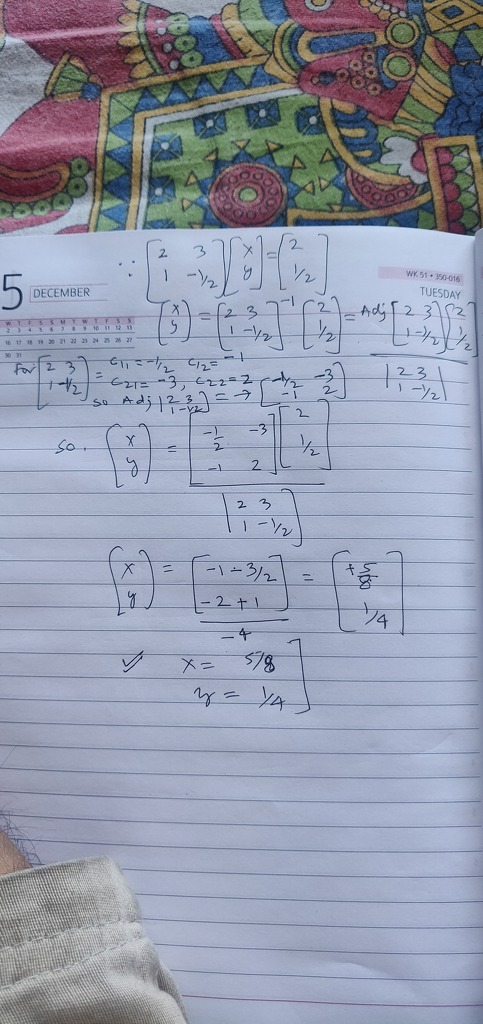
This screenshot has width=483, height=1024. Identify the location of colorful blanket. (342, 120).